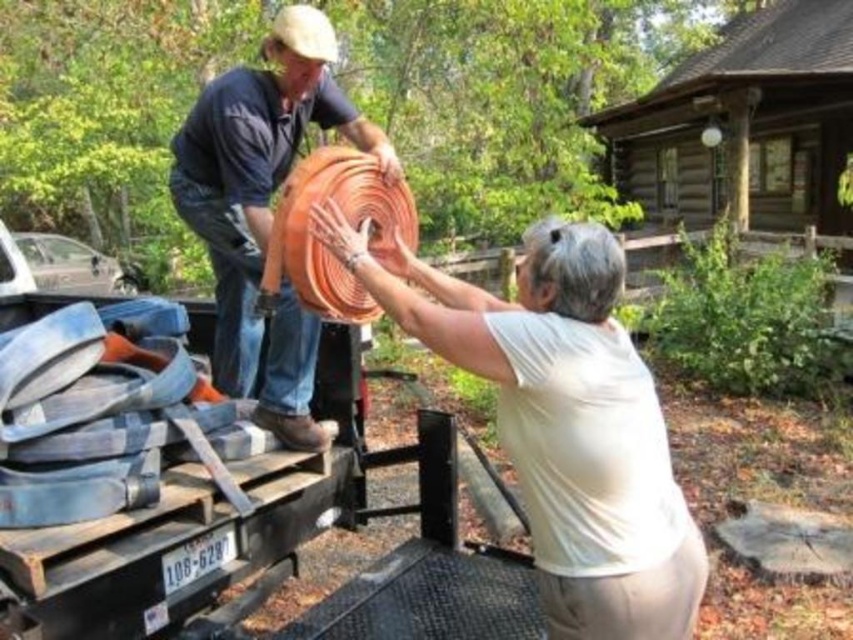
This screenshot has height=640, width=853. What do you see at coordinates (746, 124) in the screenshot?
I see `brown wooden log cabin at upper center` at bounding box center [746, 124].

Between brown wooden log cabin at upper center and orange rubber hose at center, which one is positioned lower?

orange rubber hose at center

Between point (621, 173) and point (248, 157), which one is positioned behind?

The point (621, 173) is more distant.

The image size is (853, 640). I want to click on brown wooden log cabin at upper center, so click(x=746, y=124).